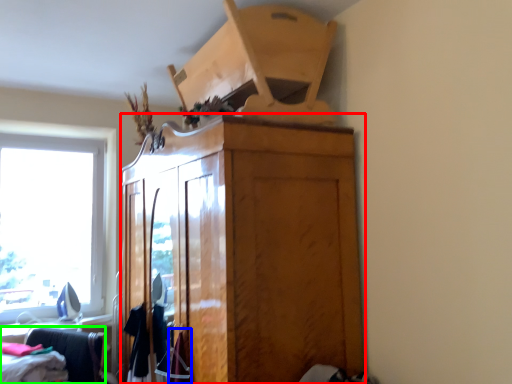
Question: Which is nearer to the cabinetry (highlighted by a red box)? clothing (highlighted by a blue box) or furniture (highlighted by a green box).

Choices:
 (A) clothing
 (B) furniture

Answer: (A)